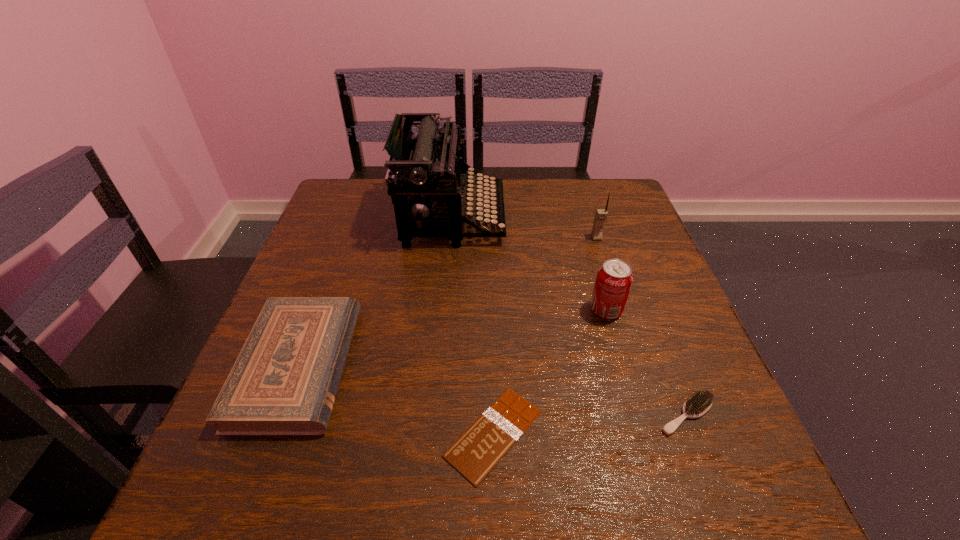
Image resolution: width=960 pixels, height=540 pixels. Identify the location of vacant space that satisfies the following two spatial constraints: 1. on the front of the cellular telephone, where the keypad is located; 2. on the spine side of the third shortest object. (638, 366).

I want to click on free space in the image that satisfies the following two spatial constraints: 1. on the front side of the soda; 2. on the spine side of the leftmost object, so click(623, 366).